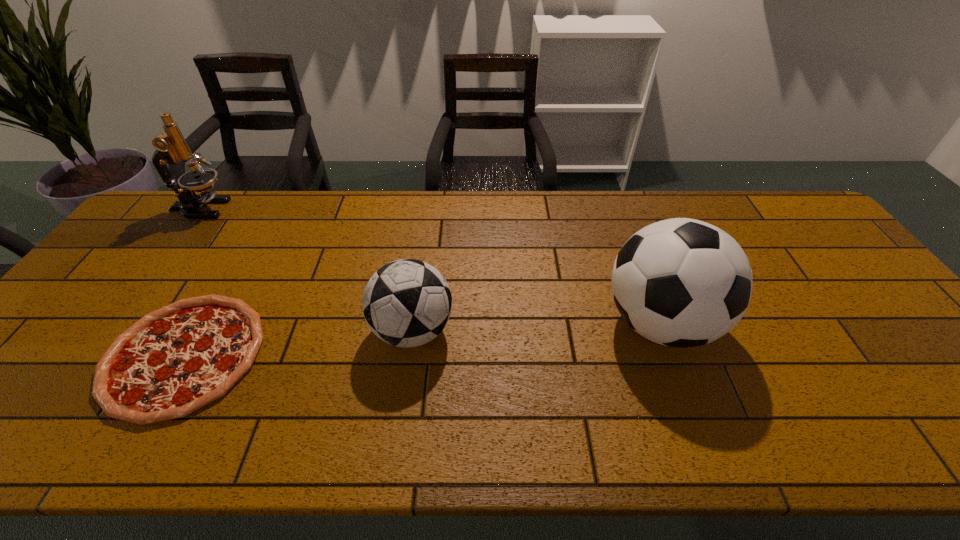
Image resolution: width=960 pixels, height=540 pixels. I want to click on microscope, so click(171, 147).

I want to click on the right soccer ball, so click(680, 282).

Identify the location of the taller soccer ball. The image size is (960, 540). (680, 282).

Where is `the third tallest object`? The height and width of the screenshot is (540, 960). the third tallest object is located at coordinates click(x=406, y=303).

What are the coordinates of `the third object from left to right` in the screenshot? It's located at (406, 303).

Locate an element on the screen. This screenshot has height=540, width=960. the shortest object is located at coordinates (175, 360).

What are the coordinates of `vacant area located at the eyepiece of the microscope` in the screenshot? It's located at (276, 209).

This screenshot has height=540, width=960. Find the location of `vacant area located on the front of the taller soccer ball`. vacant area located on the front of the taller soccer ball is located at coordinates (703, 440).

You are a GUI agent. You are given a task and a screenshot of the screen. Output one action in this format:
    pyautogui.click(x=<x>, y=<y>)
    Task: Click on the vacant space located 0.230m on the surface of the shorter soccer ball where the brand logo is visible
    This screenshot has height=540, width=960.
    Given the screenshot: What is the action you would take?
    pyautogui.click(x=545, y=330)

In order to click on free region located on the left of the pizza in this screenshot , I will do `click(52, 355)`.